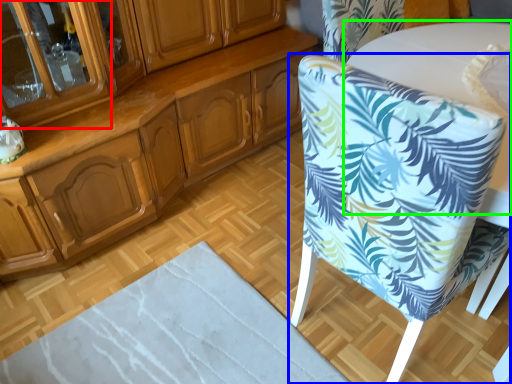
Question: Based on their relative distances, which object is nearer to glass door (highlighted by a red box)? Choose from chair (highlighted by a blue box) and round table (highlighted by a green box).

Choices:
 (A) chair
 (B) round table

Answer: (A)